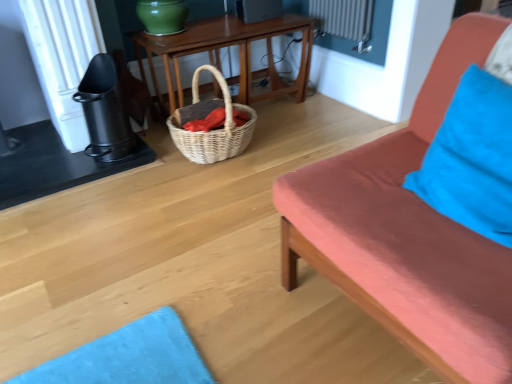
Question: Would you say woven natural picnic basket at center is part of matte coral studio couch at right's contents?

Choices:
 (A) yes
 (B) no

Answer: (B)

Question: Is matte coral studio couch at right wider than woven natural picnic basket at center?

Choices:
 (A) yes
 (B) no

Answer: (A)

Question: Is matte coral studio couch at right bigger than woven natural picnic basket at center?

Choices:
 (A) yes
 (B) no

Answer: (A)

Question: Can you confirm if matte coral studio couch at right is smaller than woven natural picnic basket at center?

Choices:
 (A) yes
 (B) no

Answer: (B)

Question: Is matte coral studio couch at right turned away from woven natural picnic basket at center?

Choices:
 (A) yes
 (B) no

Answer: (B)

Question: From a real-world perspective, is blue fabric pillow at right physically located above or below woven natural picnic basket at center?

Choices:
 (A) above
 (B) below

Answer: (A)

Question: Is blue fabric pillow at right taller or shorter than woven natural picnic basket at center?

Choices:
 (A) tall
 (B) short

Answer: (B)

Question: In terms of width, does blue fabric pillow at right look wider or thinner when compared to woven natural picnic basket at center?

Choices:
 (A) wide
 (B) thin

Answer: (B)

Question: Considering the relative positions of blue fabric pillow at right and woven natural picnic basket at center in the image provided, is blue fabric pillow at right to the left or to the right of woven natural picnic basket at center?

Choices:
 (A) left
 (B) right

Answer: (B)

Question: From the image's perspective, is woven natural picnic basket at center positioned above or below blue fabric pillow at right?

Choices:
 (A) below
 (B) above

Answer: (B)

Question: From a real-world perspective, relative to blue fabric pillow at right, is woven natural picnic basket at center vertically above or below?

Choices:
 (A) above
 (B) below

Answer: (B)

Question: Is woven natural picnic basket at center spatially inside blue fabric pillow at right, or outside of it?

Choices:
 (A) outside
 (B) inside

Answer: (A)

Question: Is point (196, 69) positioned closer to the camera than point (496, 129)?

Choices:
 (A) closer
 (B) farther

Answer: (B)

Question: Is blue fabric pillow at right in front of or behind woven wood table at center in the image?

Choices:
 (A) behind
 (B) front

Answer: (B)

Question: Would you say blue fabric pillow at right is inside or outside woven wood table at center?

Choices:
 (A) outside
 (B) inside

Answer: (A)